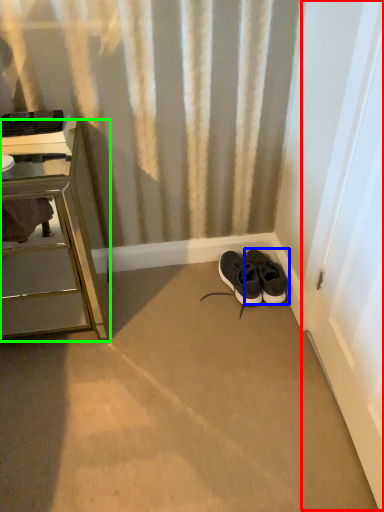
Question: Considering the real-world distances, which object is farthest from screen door (highlighted by a red box)? footwear (highlighted by a blue box) or chest of drawers (highlighted by a green box)?

Choices:
 (A) footwear
 (B) chest of drawers

Answer: (B)